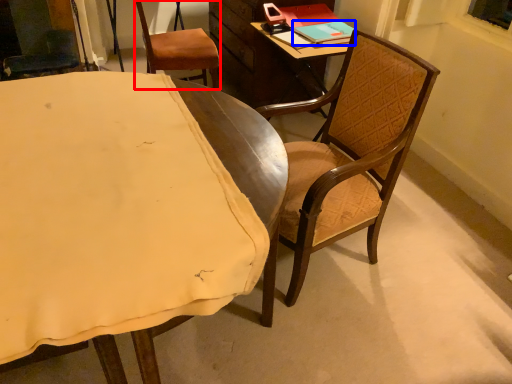
Question: Among these objects, which one is farthest to the camera, chair (highlighted by a red box) or book (highlighted by a blue box)?

Choices:
 (A) chair
 (B) book

Answer: (A)